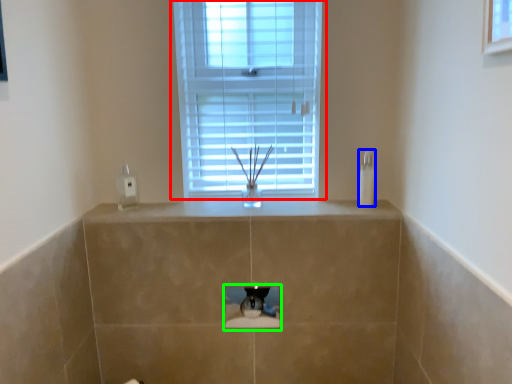
Question: Which is farther away from window (highlighted by a red box)? soap dispenser (highlighted by a blue box) or hole (highlighted by a green box)?

Choices:
 (A) soap dispenser
 (B) hole

Answer: (B)